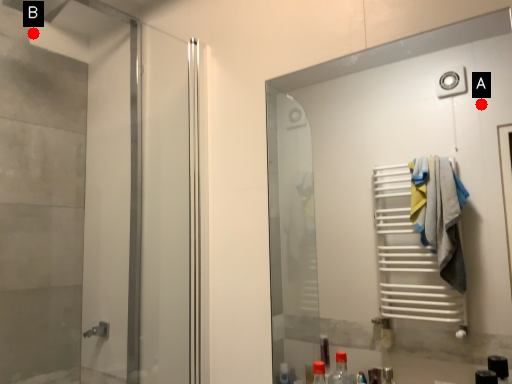
Question: Two points are circled on the image, labeled by A and B beside each circle. Which point is closer to the camera?

Choices:
 (A) A is closer
 (B) B is closer

Answer: (B)